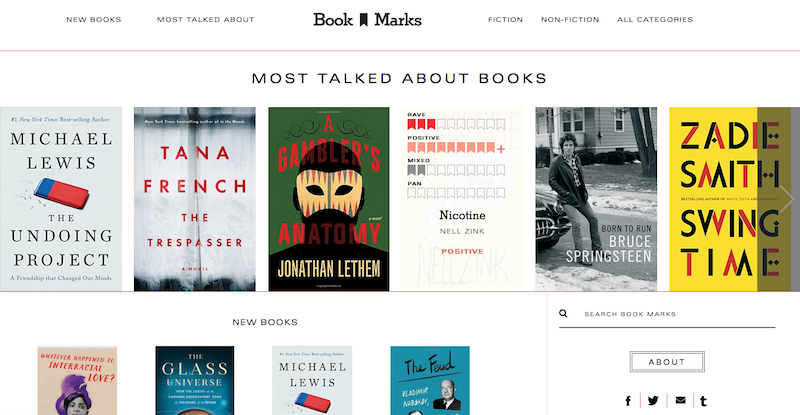
Find the location of `book covers`. book covers is located at coordinates 62,168, 198,165, 317,163, 446,153, 588,166, 704,175, 78,375, 196,375, 329,381, 409,380.